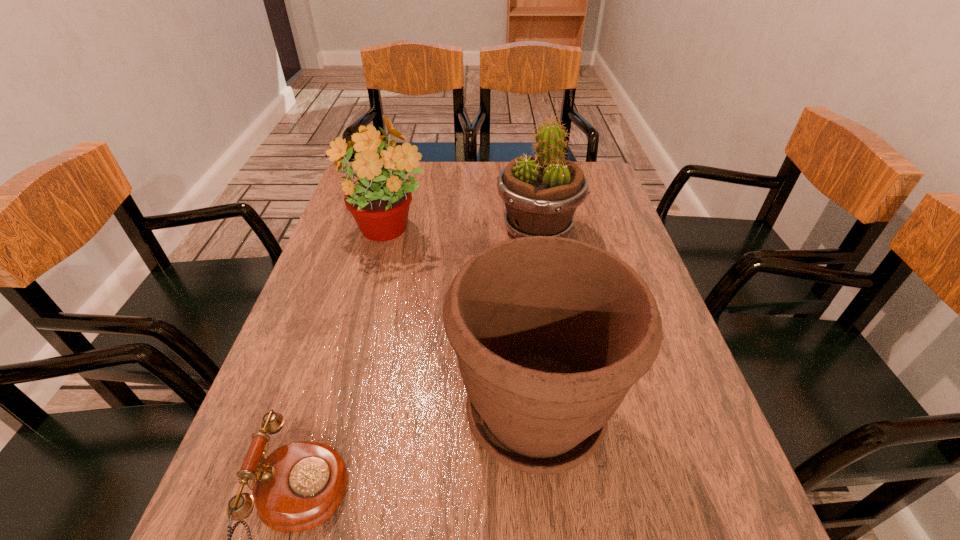
Locate an element on the screen. Image resolution: width=960 pixels, height=540 pixels. the leftmost flowerpot is located at coordinates pyautogui.click(x=379, y=202).

At what (x,y) coordinates should I click in order to perform the action: click on the nearest flowerpot. Please return your answer as a coordinate pair (x, y). Image resolution: width=960 pixels, height=540 pixels. Looking at the image, I should click on (550, 333).

Locate an element on the screen. This screenshot has width=960, height=540. free spot located on the back of the leftmost flowerpot is located at coordinates (400, 181).

You are a GUI agent. You are given a task and a screenshot of the screen. Output one action in this format:
    pyautogui.click(x=<x>, y=<y>)
    Task: Click on the vacant space located 0.180m on the back of the nearest flowerpot
    The width and height of the screenshot is (960, 540).
    Given the screenshot: What is the action you would take?
    pyautogui.click(x=522, y=289)

Identify the location of object located in the left edge section of the desktop. (379, 202).

At what (x,y) coordinates should I click in order to perform the action: click on vacant space at the far edge. Please return your answer as a coordinate pair (x, y). The height and width of the screenshot is (540, 960). Looking at the image, I should click on (484, 197).

Image resolution: width=960 pixels, height=540 pixels. In the image, there is a desktop. Identify the location of vacant space at the left edge. (346, 225).

Where is `free space at the right edge of the desktop`? The width and height of the screenshot is (960, 540). free space at the right edge of the desktop is located at coordinates (694, 427).

In order to click on free region at the far right corner in this screenshot , I will do point(593,190).

At what (x,y) coordinates should I click in order to perform the action: click on object that can be found as the closest to the leftmost flowerpot. Please return your answer as a coordinate pair (x, y). Looking at the image, I should click on click(541, 193).